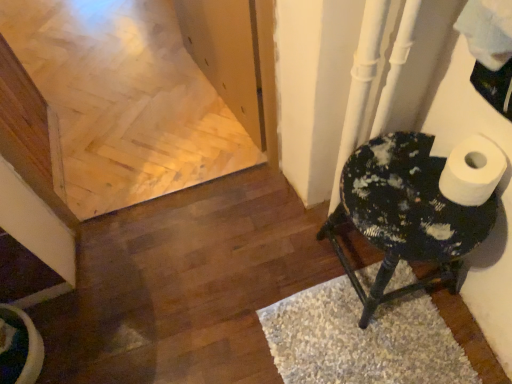
Question: Should I look upward or downward to see white shaggy rug at lower right?

Choices:
 (A) up
 (B) down

Answer: (B)

Question: Is speckled black stool at right aimed at white shaggy rug at lower right?

Choices:
 (A) yes
 (B) no

Answer: (B)

Question: Considering the relative positions of speckled black stool at right and white shaggy rug at lower right in the image provided, is speckled black stool at right behind white shaggy rug at lower right?

Choices:
 (A) yes
 (B) no

Answer: (B)

Question: Considering the relative sizes of speckled black stool at right and white shaggy rug at lower right in the image provided, is speckled black stool at right thinner than white shaggy rug at lower right?

Choices:
 (A) yes
 (B) no

Answer: (A)

Question: Can you confirm if speckled black stool at right is smaller than white shaggy rug at lower right?

Choices:
 (A) yes
 (B) no

Answer: (B)

Question: Does speckled black stool at right come in front of white shaggy rug at lower right?

Choices:
 (A) no
 (B) yes

Answer: (B)

Question: Considering the relative positions of speckled black stool at right and white shaggy rug at lower right in the image provided, is speckled black stool at right to the right of white shaggy rug at lower right from the viewer's perspective?

Choices:
 (A) no
 (B) yes

Answer: (B)

Question: From the image's perspective, is white shaggy rug at lower right on top of speckled black stool at right?

Choices:
 (A) no
 (B) yes

Answer: (A)

Question: Considering the relative sizes of white shaggy rug at lower right and speckled black stool at right in the image provided, is white shaggy rug at lower right shorter than speckled black stool at right?

Choices:
 (A) yes
 (B) no

Answer: (A)

Question: Could you tell me if white shaggy rug at lower right is turned towards speckled black stool at right?

Choices:
 (A) no
 (B) yes

Answer: (A)

Question: Is white shaggy rug at lower right further to camera compared to speckled black stool at right?

Choices:
 (A) yes
 (B) no

Answer: (A)

Question: Is white shaggy rug at lower right at the left side of speckled black stool at right?

Choices:
 (A) no
 (B) yes

Answer: (B)

Question: Is white shaggy rug at lower right at the right side of speckled black stool at right?

Choices:
 (A) yes
 (B) no

Answer: (B)

Question: From the image's perspective, relative to white shaggy rug at lower right, is speckled black stool at right above or below?

Choices:
 (A) below
 (B) above

Answer: (B)